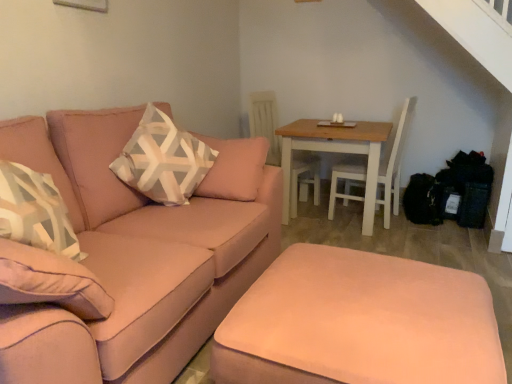
This screenshot has width=512, height=384. Describe the element at coordinates (336, 152) in the screenshot. I see `light brown wooden table at center right` at that location.

The height and width of the screenshot is (384, 512). What do you see at coordinates (155, 236) in the screenshot?
I see `satin pink couch at left` at bounding box center [155, 236].

Measure the distance between satin pink ottoman at lower center and camera.

satin pink ottoman at lower center is 1.06 meters away from camera.

At what (x,y) coordinates should I click in order to perform the action: click on white wood swivel chair at center. Please return your answer as a coordinate pair (x, y). Image resolution: width=512 pixels, height=384 pixels. Looking at the image, I should click on (265, 123).

At what (x,y) coordinates should I click in order to perform the action: click on throw pillow above the light brown wooden table at center right (from the image's perspective). Please return your answer as a coordinate pair (x, y). The width and height of the screenshot is (512, 384). Looking at the image, I should click on (163, 160).

Would you say light brown wooden table at center right is a long distance from patterned fabric pillow at center-left?

Indeed, light brown wooden table at center right is not near patterned fabric pillow at center-left.

Is light brown wooden table at center right oriented towards patterned fabric pillow at center-left?

No, light brown wooden table at center right is not facing towards patterned fabric pillow at center-left.

Considering their positions, is white wood swivel chair at center located in front of or behind satin pink couch at left?

white wood swivel chair at center is behind satin pink couch at left.

Is white wood swivel chair at center facing away from satin pink couch at left?

No, white wood swivel chair at center's orientation is not away from satin pink couch at left.

Considering the relative sizes of white wood swivel chair at center and satin pink couch at left in the image provided, is white wood swivel chair at center taller than satin pink couch at left?

Correct, white wood swivel chair at center is much taller as satin pink couch at left.

Consider the image. Which is more to the right, white wood swivel chair at center or satin pink couch at left?

From the viewer's perspective, white wood swivel chair at center appears more on the right side.

Are light brown wooden table at center right and white wood swivel chair at center making contact?

No, light brown wooden table at center right is not touching white wood swivel chair at center.

From the picture: How much distance is there between light brown wooden table at center right and white wood swivel chair at center?

A distance of 16.63 inches exists between light brown wooden table at center right and white wood swivel chair at center.

Is light brown wooden table at center right at the left side of white wood swivel chair at center?

No.

Is light brown wooden table at center right bigger or smaller than white wood swivel chair at center?

Considering their sizes, light brown wooden table at center right takes up more space than white wood swivel chair at center.

Looking at this image, does satin pink ottoman at lower center have a larger size compared to light brown wooden table at center right?

Actually, satin pink ottoman at lower center might be smaller than light brown wooden table at center right.

At what (x,y) coordinates should I click in order to perform the action: click on the footrest located below the light brown wooden table at center right (from the image's perspective). Please return your answer as a coordinate pair (x, y). Image resolution: width=512 pixels, height=384 pixels. Looking at the image, I should click on (359, 323).

Is satin pink ottoman at lower center not within light brown wooden table at center right?

Yes.

From the image's perspective, is satin pink ottoman at lower center above or below light brown wooden table at center right?

From the image's perspective, satin pink ottoman at lower center appears below light brown wooden table at center right.

Is satin pink couch at left wider than white wood swivel chair at center?

Correct, the width of satin pink couch at left exceeds that of white wood swivel chair at center.

Is white wood swivel chair at center completely or partially inside satin pink couch at left?

No, white wood swivel chair at center is located outside of satin pink couch at left.

From a real-world perspective, between satin pink couch at left and white wood swivel chair at center, who is vertically higher?

white wood swivel chair at center, from a real-world perspective.

Is satin pink couch at left positioned with its back to white wood swivel chair at center?

satin pink couch at left is not turned away from white wood swivel chair at center.

Is satin pink ottoman at lower center wider or thinner than patterned fabric pillow at center-left?

Clearly, satin pink ottoman at lower center has more width compared to patterned fabric pillow at center-left.

Which is in front, satin pink ottoman at lower center or patterned fabric pillow at center-left?

satin pink ottoman at lower center is closer to the camera.

Considering the points (291, 322) and (181, 178), which point is in front, point (291, 322) or point (181, 178)?

The point (291, 322) is in front.

Does satin pink couch at left contain light brown wooden table at center right?

No, light brown wooden table at center right is not surrounded by satin pink couch at left.

From a real-world perspective, is satin pink couch at left physically above light brown wooden table at center right?

Yes, from a real-world perspective, satin pink couch at left is above light brown wooden table at center right.

Is point (152, 270) farther from viewer compared to point (379, 146)?

No, (152, 270) is in front of (379, 146).

I want to click on throw pillow that is on the left side of light brown wooden table at center right, so click(x=163, y=160).

Where is `studio couch below the white wood swivel chair at center (from the image's perspective)`? The image size is (512, 384). studio couch below the white wood swivel chair at center (from the image's perspective) is located at coordinates [155, 236].

Looking at the image, which one is located closer to light brown wooden table at center right, white wood swivel chair at center or satin pink ottoman at lower center?

white wood swivel chair at center is closer to light brown wooden table at center right.

Considering their positions, is white wood swivel chair at center positioned closer to satin pink couch at left than satin pink ottoman at lower center?

Based on the image, satin pink ottoman at lower center appears to be nearer to satin pink couch at left.

From the image, which object appears to be nearer to light brown wooden table at center right, satin pink couch at left or patterned fabric pillow at center-left?

Based on the image, patterned fabric pillow at center-left appears to be nearer to light brown wooden table at center right.

Based on the photo, estimate the real-world distances between objects in this image. Which object is closer to satin pink ottoman at lower center, patterned fabric pillow at center-left or white wood swivel chair at center?

patterned fabric pillow at center-left is positioned closer to the anchor satin pink ottoman at lower center.

Based on their spatial positions, is satin pink couch at left or light brown wooden table at center right closer to satin pink ottoman at lower center?

Based on the image, satin pink couch at left appears to be nearer to satin pink ottoman at lower center.

Estimate the real-world distances between objects in this image. Which object is closer to satin pink couch at left, light brown wooden table at center right or satin pink ottoman at lower center?

satin pink ottoman at lower center is closer to satin pink couch at left.

Estimate the real-world distances between objects in this image. Which object is further from patterned fabric pillow at center-left, satin pink couch at left or satin pink ottoman at lower center?

satin pink ottoman at lower center lies further to patterned fabric pillow at center-left than the other object.

When comparing their distances from satin pink couch at left, does satin pink ottoman at lower center or patterned fabric pillow at center-left seem further?

satin pink ottoman at lower center is positioned further to the anchor satin pink couch at left.

Locate an element on the screen. This screenshot has height=384, width=512. footrest between satin pink couch at left and light brown wooden table at center right in the front-back direction is located at coordinates (359, 323).

At what (x,y) coordinates should I click in order to perform the action: click on footrest between satin pink couch at left and white wood swivel chair at center along the z-axis. Please return your answer as a coordinate pair (x, y). This screenshot has width=512, height=384. Looking at the image, I should click on (x=359, y=323).

Locate an element on the screen. throw pillow between satin pink couch at left and white wood swivel chair at center from front to back is located at coordinates (163, 160).

Identify the location of table between satin pink couch at left and white wood swivel chair at center in the front-back direction. (336, 152).